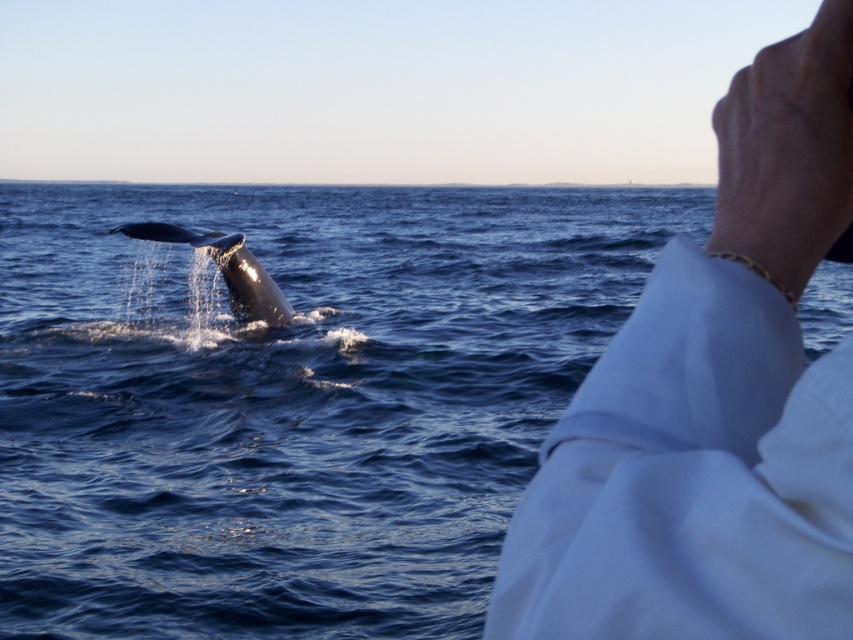
Is blue water at whale left below white cloth at upper right?

Incorrect, blue water at whale left is not positioned below white cloth at upper right.

Is blue water at whale left to the left of white cloth at upper right from the viewer's perspective?

Indeed, blue water at whale left is positioned on the left side of white cloth at upper right.

Looking at this image, who is more forward, (843,292) or (682,396)?

Point (682,396) is in front.

Where is `blue water at whale left`? The height and width of the screenshot is (640, 853). blue water at whale left is located at coordinates (292, 397).

Is blue water at whale left bigger than gray smooth whale at left?

Correct, blue water at whale left is larger in size than gray smooth whale at left.

Is point (71, 600) farther from camera compared to point (247, 276)?

No, (71, 600) is in front of (247, 276).

Where is `blue water at whale left`? This screenshot has height=640, width=853. blue water at whale left is located at coordinates (292, 397).

In the scene shown: Between white cloth at upper right and gray smooth whale at left, which one is positioned lower?

white cloth at upper right is below.

Is white cloth at upper right shorter than gray smooth whale at left?

Correct, white cloth at upper right is not as tall as gray smooth whale at left.

You are a GUI agent. You are given a task and a screenshot of the screen. Output one action in this format:
    pyautogui.click(x=<x>, y=<y>)
    Task: Click on the white cloth at upper right
    This screenshot has height=640, width=853.
    Given the screenshot: What is the action you would take?
    pyautogui.click(x=712, y=403)